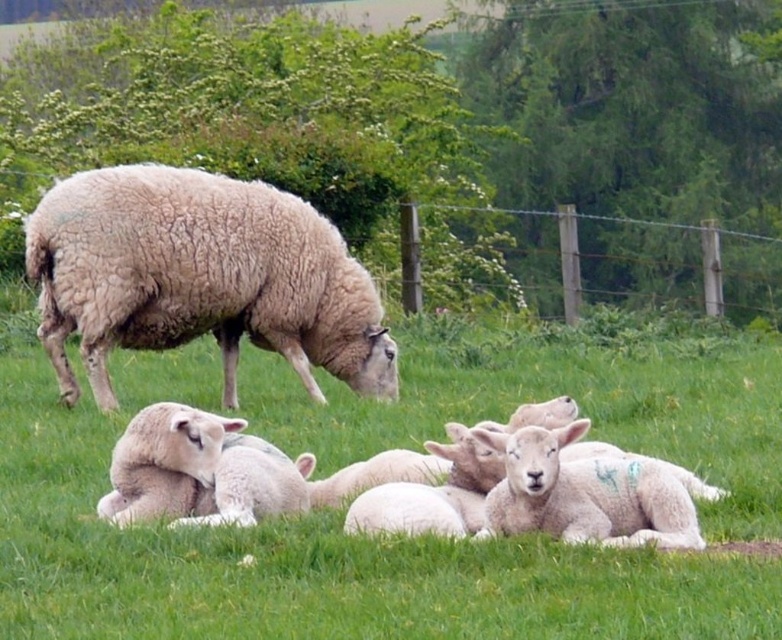
Is white woolen sheep at lower center above wooden post at upper center?

Incorrect, white woolen sheep at lower center is not positioned above wooden post at upper center.

What do you see at coordinates (160, 452) in the screenshot?
I see `white woolen sheep at lower center` at bounding box center [160, 452].

In order to click on white woolen sheep at lower center in this screenshot , I will do `click(160, 452)`.

Does white woolen sheep at center lie in front of white woolly sheep at center?

Yes, it is.

The height and width of the screenshot is (640, 782). Find the location of `white woolen sheep at center`. white woolen sheep at center is located at coordinates (303, 552).

Between point (665, 467) and point (445, 467), which one is positioned behind?

The point (445, 467) is behind.

Is point (648, 461) positioned before point (555, 406)?

Yes, it is in front of point (555, 406).

Locate an element on the screen. The height and width of the screenshot is (640, 782). white woolen lamb at lower right is located at coordinates (585, 493).